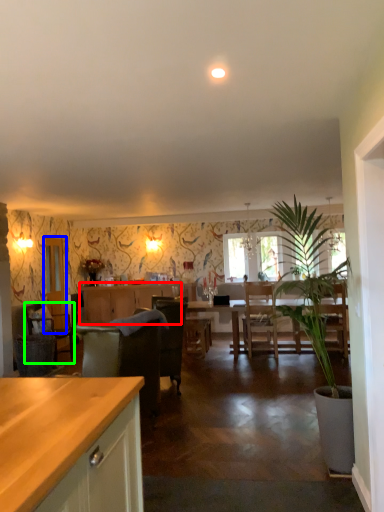
Question: Considering the real-world distances, which object is farthest from cabinetry (highlighted by a red box)? glass door (highlighted by a blue box) or chair (highlighted by a green box)?

Choices:
 (A) glass door
 (B) chair

Answer: (B)